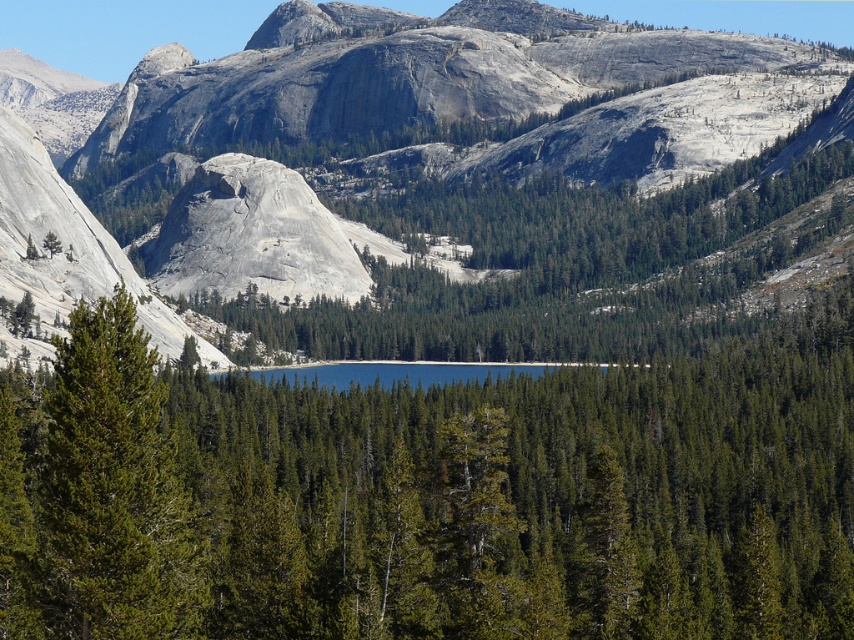
You are a hiker trying to locate the matte gray rock at center in the mountainous landscape. Based on the scene description, can you determine its exact coordinates?

The matte gray rock at center is located at coordinates point (x=442, y=177).